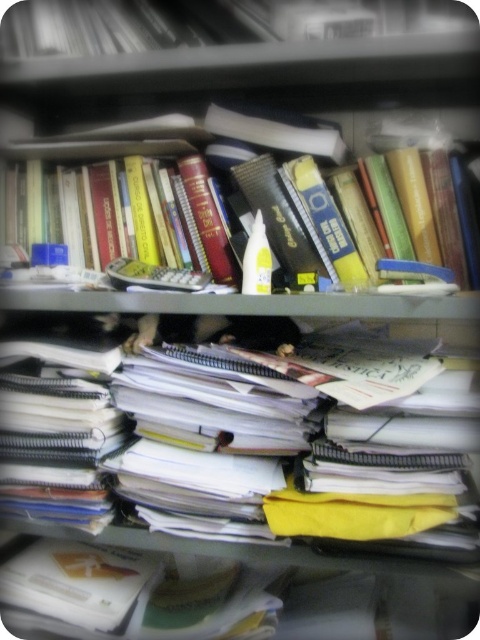
You are organizing a shelf and need to place a new item between the white paper notebook at center and the hardcover book at upper left. Which object should you place your item next to if you want it to be closer to the larger object?

You should place your item next to the white paper notebook at center because it is larger than the hardcover book at upper left according to the description.

You are trying to locate two specific points on the cluttered shelf. Given their coordinates, which point is closer to your viewpoint? The points are point (305, 371) and point (439, 214).

Point (305, 371) is closer to the camera than point (439, 214).

Looking at this image, you are organizing your desk and need to place a new item between the white paper notebook at center and the camera. The item you want to place is 12 inches long. Is there enough space between them?

The distance between the white paper notebook at center and the camera is 26.88 inches. Since the item you want to place is only 12 inches long, there is sufficient space to accommodate it between them.